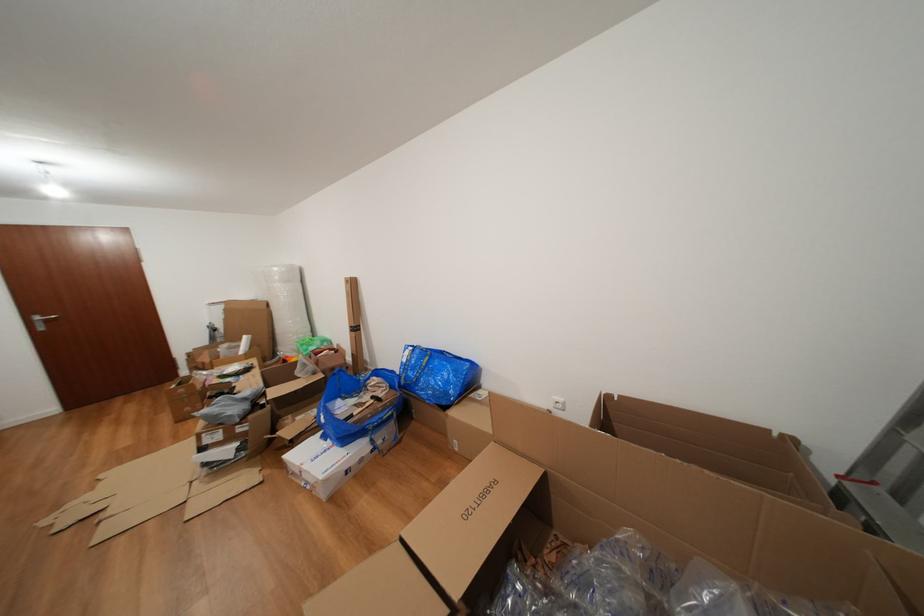
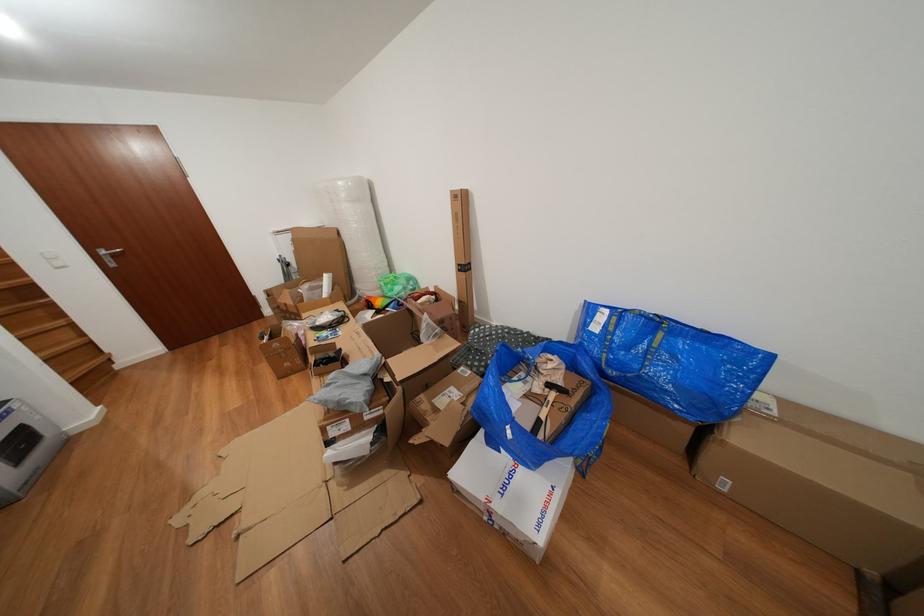
In the second image, find the point that corresponds to [45,323] in the first image.

(112, 257)